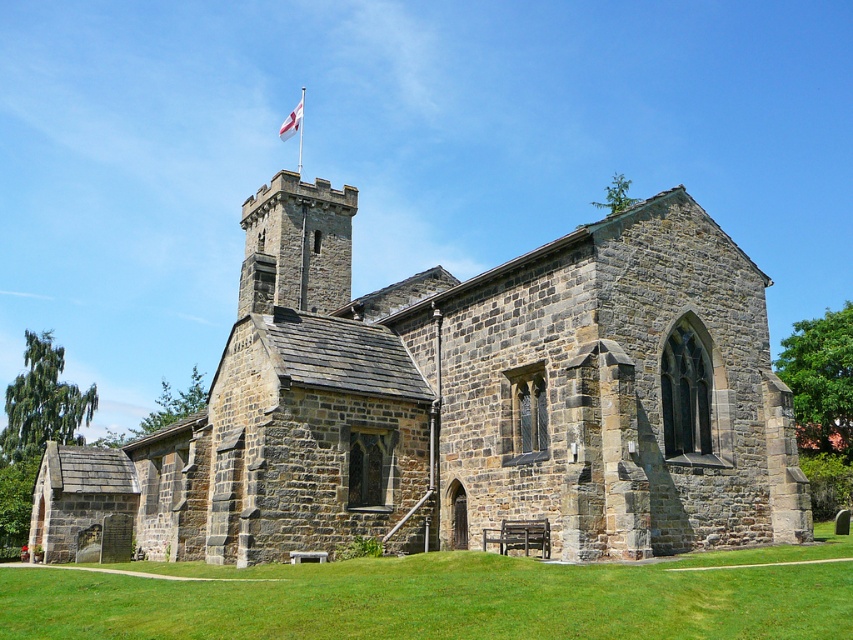
Which is in front, point (698, 225) or point (810, 630)?

Positioned in front is point (810, 630).

Does gray stone church at center have a greater width compared to green grass at lower center?

Correct, the width of gray stone church at center exceeds that of green grass at lower center.

Who is more distant from viewer, [434,420] or [486,628]?

Positioned behind is point [434,420].

Locate an element on the screen. The width and height of the screenshot is (853, 640). gray stone church at center is located at coordinates (465, 401).

Based on the photo, does dark gray stone tower at center come behind white fabric flag at upper center?

No, dark gray stone tower at center is closer to the viewer.

Who is shorter, dark gray stone tower at center or white fabric flag at upper center?

With less height is white fabric flag at upper center.

Locate an element on the screen. dark gray stone tower at center is located at coordinates (296, 244).

Where is `dark gray stone tower at center`? dark gray stone tower at center is located at coordinates tap(296, 244).

Can you confirm if white fabric flag at upper center is wider than metallic flag pole at upper center?

Yes, white fabric flag at upper center is wider than metallic flag pole at upper center.

Which is in front, point (303, 90) or point (299, 144)?

Point (299, 144) is more forward.

The image size is (853, 640). In order to click on white fabric flag at upper center in this screenshot , I will do `click(292, 122)`.